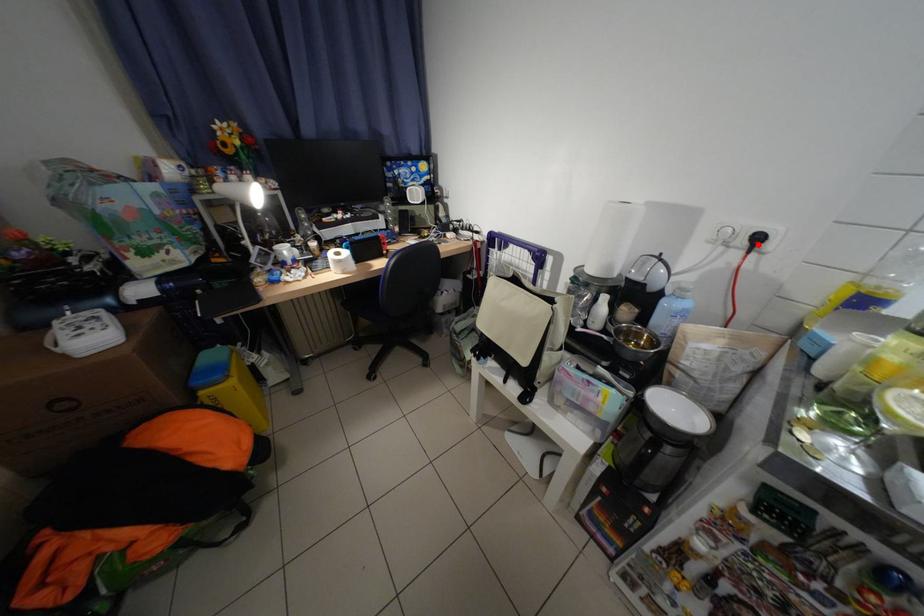
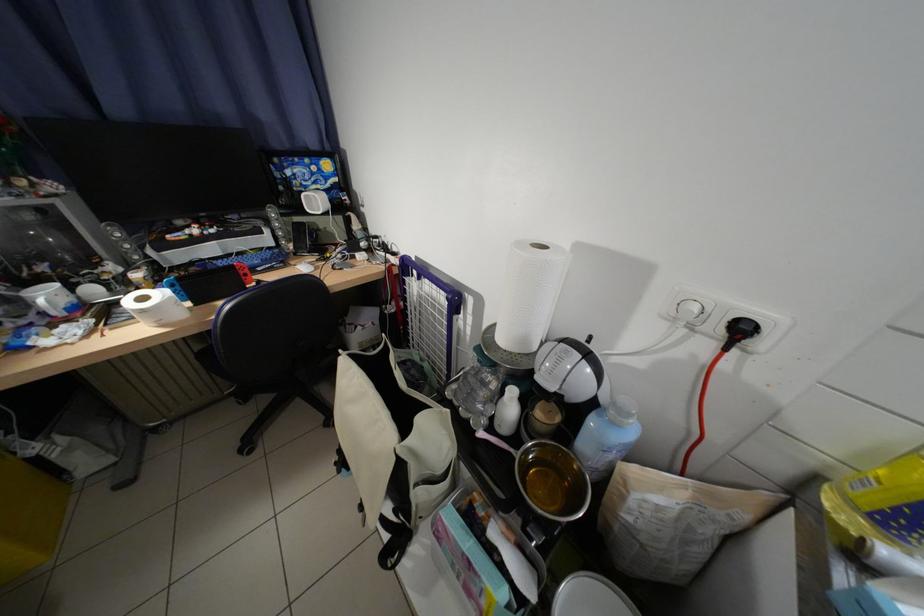
The point at the highlighted location is marked in the first image. Where is the corresponding point in the second image?

(734, 333)